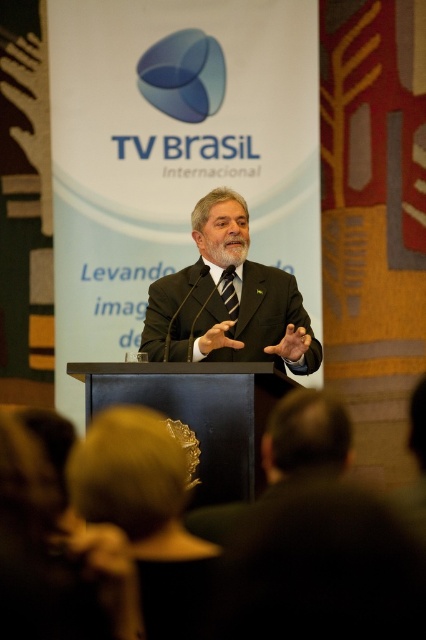
Is blurred hair at lower left shorter than black striped tie at center?

No.

Does blurred hair at lower left appear on the left side of black striped tie at center?

Indeed, blurred hair at lower left is positioned on the left side of black striped tie at center.

Does point (29, 513) lie in front of point (232, 276)?

That is True.

Locate an element on the screen. This screenshot has height=640, width=426. blurred hair at lower left is located at coordinates (63, 545).

Does point (193, 637) come in front of point (94, 563)?

Yes, it is in front of point (94, 563).

You are a GUI agent. You are given a task and a screenshot of the screen. Output one action in this format:
    pyautogui.click(x=<x>, y=<y>)
    Task: Click on the silky yellow hat at lower center
    
    Given the screenshot: What is the action you would take?
    (x=146, y=515)

Find the location of a particular element. This screenshot has height=640, width=426. silky yellow hat at lower center is located at coordinates (146, 515).

Is silky yellow hat at lower center further to the viewer compared to black striped tie at center?

That is False.

Is point (175, 636) positioned before point (224, 285)?

Yes, point (175, 636) is in front of point (224, 285).

Which is behind, point (181, 570) or point (230, 284)?

The point (230, 284) is behind.

This screenshot has height=640, width=426. I want to click on silky yellow hat at lower center, so point(146,515).